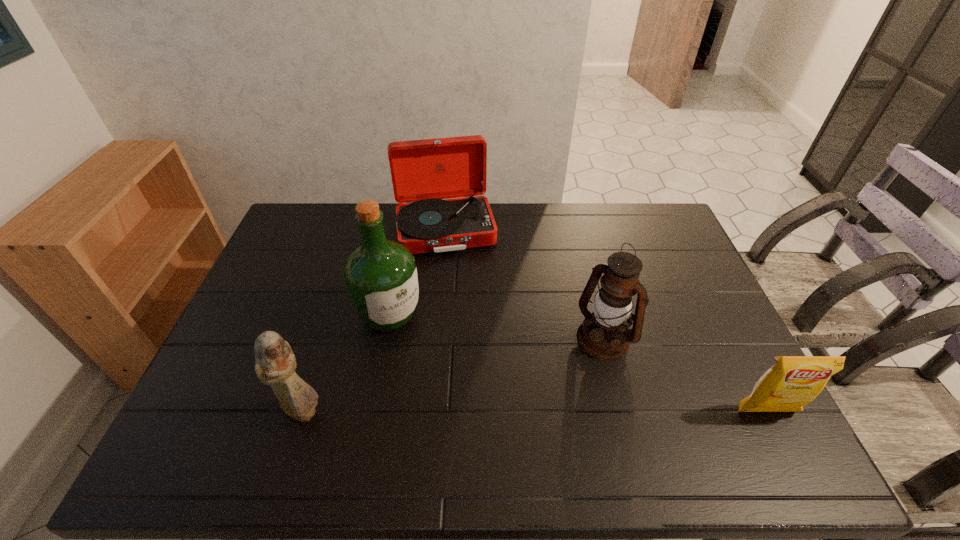
At what (x,y) coordinates should I click in order to perform the action: click on vacant space on the desktop that is between the figurine and the crisp (potato chip) and is positioned on the side of the second object from right to left, there is a wick adjustment knob. Please return your answer as a coordinate pair (x, y). This screenshot has width=960, height=540. Looking at the image, I should click on [532, 411].

Locate an element on the screen. vacant spot on the desktop that is between the leftmost object and the rightmost object and is positioned on the front-facing side of the liquor is located at coordinates (491, 411).

Where is `vacant space on the desktop that is between the leftmost object and the shortest object and is positioned on the front-facing side of the farthest object`? vacant space on the desktop that is between the leftmost object and the shortest object and is positioned on the front-facing side of the farthest object is located at coordinates coord(480,411).